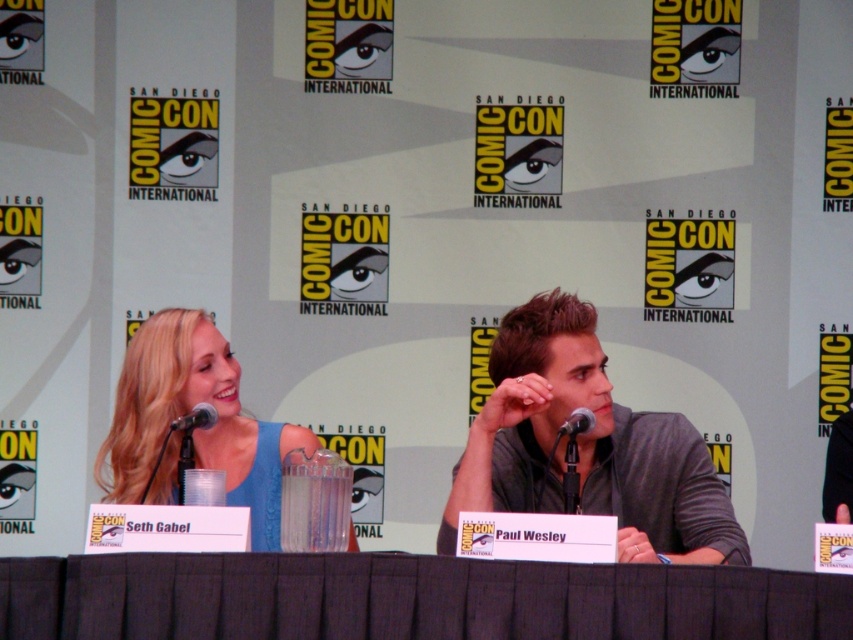
Question: Which of the following is the closest to the observer?

Choices:
 (A) (209, 422)
 (B) (567, 422)
 (C) (579, 332)

Answer: (B)

Question: Estimate the real-world distances between objects in this image. Which object is closer to the black metallic microphone at left?

Choices:
 (A) black fabric table at center
 (B) black metallic microphone at center
 (C) blue satin dress at center
 (D) gray matte shirt at center

Answer: (C)

Question: Is black metallic microphone at left above black metallic microphone at center?

Choices:
 (A) yes
 (B) no

Answer: (A)

Question: Can you confirm if gray matte shirt at center is smaller than black metallic microphone at left?

Choices:
 (A) yes
 (B) no

Answer: (B)

Question: Which point appears closest to the camera in this image?

Choices:
 (A) (585, 470)
 (B) (566, 428)
 (C) (263, 481)

Answer: (B)

Question: Does gray matte shirt at center have a smaller size compared to black metallic microphone at left?

Choices:
 (A) no
 (B) yes

Answer: (A)